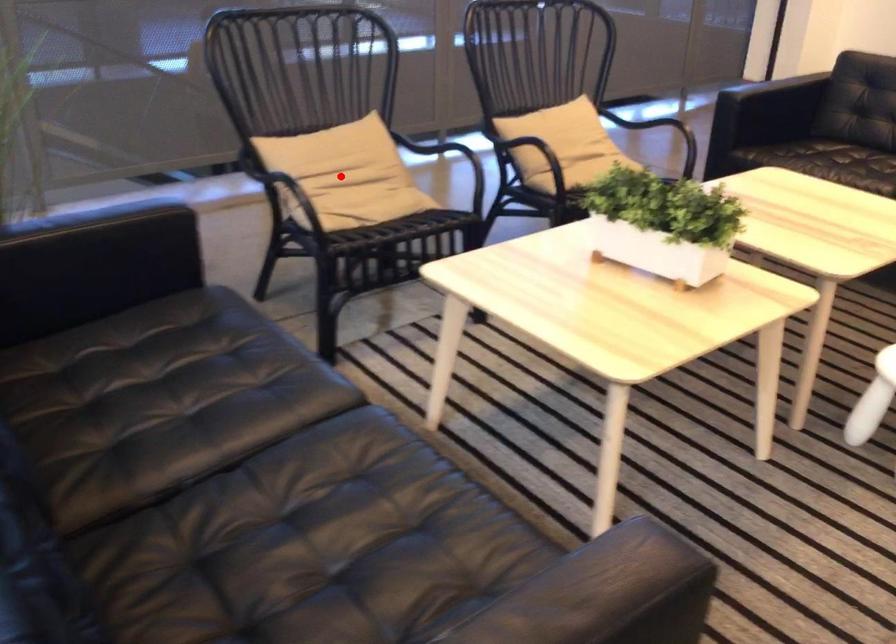
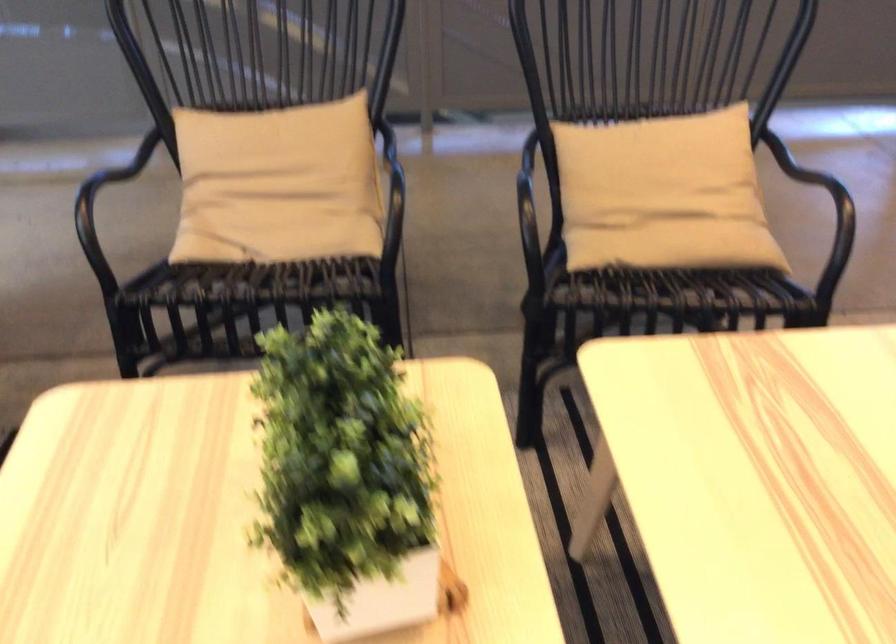
The point at the highlighted location is marked in the first image. Where is the corresponding point in the second image?

(278, 184)